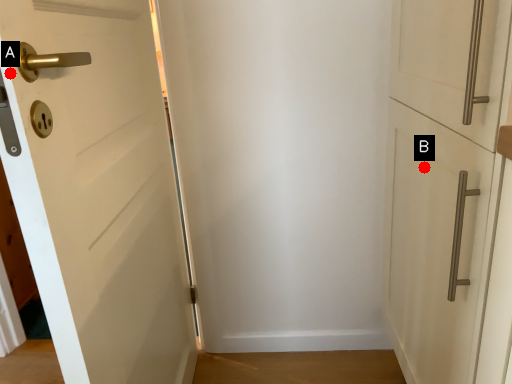
Question: Two points are circled on the image, labeled by A and B beside each circle. Which point is further to the camera?

Choices:
 (A) A is further
 (B) B is further

Answer: (B)